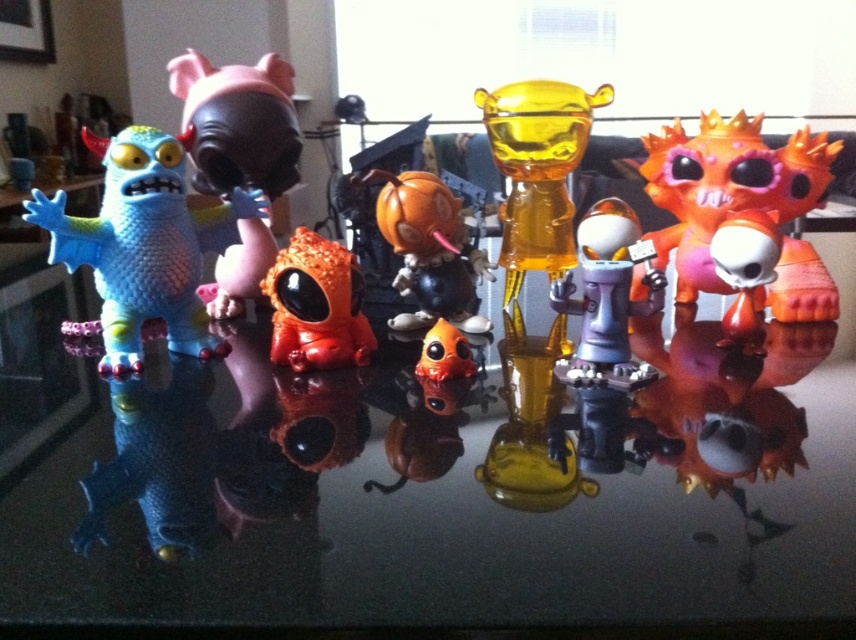
You have a small toy car that is 5 inches long. You want to place it between the translucent yellow figure at center and the metallic gray robot at center without overlapping them. Is there enough space?

The translucent yellow figure at center is 4.71 inches away from the metallic gray robot at center. Since the toy car is 5 inches long, it would not fit between them as the distance is slightly less than the car length.

You are organizing a display of collectible toys on a shelf. You have two items to place next to each other. The matte plastic pig at center and the orange matte alien at center. Which one should you place first if you want the larger item to be on the left side?

The matte plastic pig at center is larger than the orange matte alien at center, so you should place the matte plastic pig at center first on the left side to have the larger item there.

You are trying to place a new figurine between the translucent yellow figure at center and the metallic gray robot at center. Given that the new figurine is 10 cm tall, will it fit vertically between them without overlapping?

The translucent yellow figure at center is much taller than the metallic gray robot at center. Since the new figurine is only 10 cm tall, it should fit vertically between them as long as there is enough space between their bases. However, the exact vertical clearance depends on the height difference between the two figures and their positions on the reflective surface.